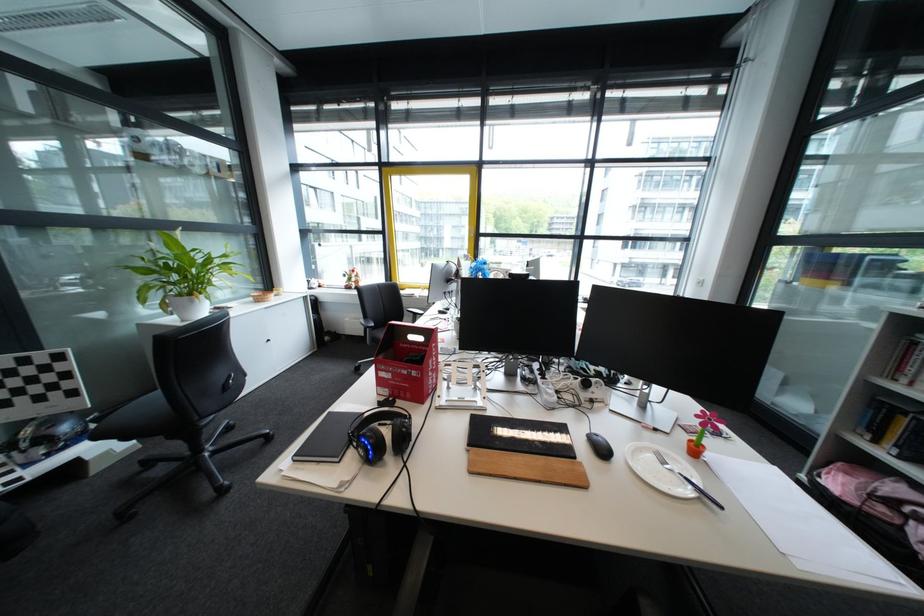
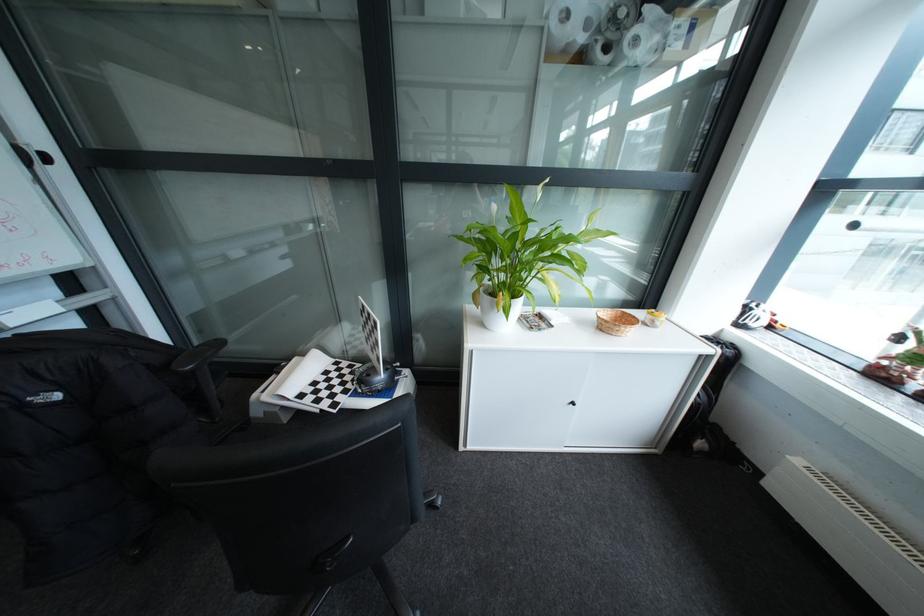
Question: I am providing you with two images of the same scene from different viewpoints. After the viewpoint changes to image2, which objects are now occluded?

Choices:
 (A) white plant pot
 (B) light blue cup
 (C) black cabinet knob
 (D) black chair sitting surface

Answer: (D)